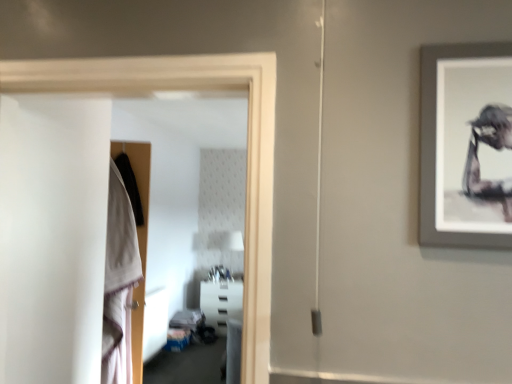
Question: Can you confirm if white plastic shelf at center is thinner than transparent glass door at left?

Choices:
 (A) no
 (B) yes

Answer: (A)

Question: Does white plastic shelf at center have a lesser height compared to transparent glass door at left?

Choices:
 (A) yes
 (B) no

Answer: (A)

Question: Is white plastic shelf at center closer to camera compared to transparent glass door at left?

Choices:
 (A) no
 (B) yes

Answer: (A)

Question: Is white plastic shelf at center at the right side of transparent glass door at left?

Choices:
 (A) yes
 (B) no

Answer: (B)

Question: Does white plastic shelf at center have a smaller size compared to transparent glass door at left?

Choices:
 (A) no
 (B) yes

Answer: (A)

Question: Visually, is white cotton robe at left positioned to the left or to the right of transparent glass door at left?

Choices:
 (A) right
 (B) left

Answer: (B)

Question: In terms of width, does white cotton robe at left look wider or thinner when compared to transparent glass door at left?

Choices:
 (A) thin
 (B) wide

Answer: (B)

Question: From the image's perspective, relative to transparent glass door at left, is white cotton robe at left above or below?

Choices:
 (A) below
 (B) above

Answer: (A)

Question: Is white cotton robe at left in front of or behind transparent glass door at left in the image?

Choices:
 (A) front
 (B) behind

Answer: (B)

Question: Do you think white cotton robe at left is within white plastic shelf at center, or outside of it?

Choices:
 (A) outside
 (B) inside

Answer: (A)

Question: Is white cotton robe at left wider or thinner than white plastic shelf at center?

Choices:
 (A) wide
 (B) thin

Answer: (B)

Question: Considering the positions of white cotton robe at left and white plastic shelf at center in the image, is white cotton robe at left taller or shorter than white plastic shelf at center?

Choices:
 (A) tall
 (B) short

Answer: (A)

Question: Considering the relative positions of white cotton robe at left and white plastic shelf at center in the image provided, is white cotton robe at left to the left or to the right of white plastic shelf at center?

Choices:
 (A) right
 (B) left

Answer: (B)

Question: From the image's perspective, is white plastic shelf at center located above or below transparent glass door at left?

Choices:
 (A) below
 (B) above

Answer: (A)

Question: Is white plastic shelf at center to the left or to the right of transparent glass door at left in the image?

Choices:
 (A) right
 (B) left

Answer: (B)